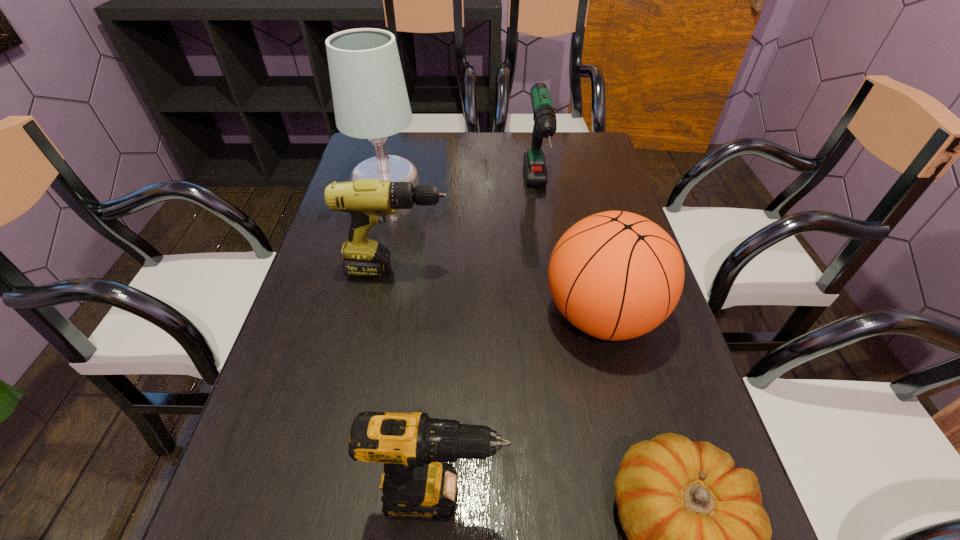
Locate an element on the screen. The width and height of the screenshot is (960, 540). vacant point located between the tallest object and the basketball is located at coordinates (494, 251).

Locate an element on the screen. free spot between the basketball and the tallest object is located at coordinates (494, 251).

What are the coordinates of `vacant space that's between the nearest drill and the basketball` in the screenshot? It's located at (521, 406).

This screenshot has height=540, width=960. I want to click on vacant space in between the tallest object and the nearest drill, so click(414, 341).

Find the location of a particular element. free area in between the second farthest drill and the nearest drill is located at coordinates (420, 383).

Identify which object is located as the second nearest to the nearest drill. Please provide its 2D coordinates. Your answer should be formatted as a tuple, i.e. [(x, y)], where the tuple contains the x and y coordinates of a point satisfying the conditions above.

[(615, 275)]

This screenshot has height=540, width=960. In order to click on the closest object to the gourd in this screenshot , I will do `click(415, 486)`.

Identify which drill is the closest to the basketball. Please provide its 2D coordinates. Your answer should be formatted as a tuple, i.e. [(x, y)], where the tuple contains the x and y coordinates of a point satisfying the conditions above.

[(545, 124)]

Select which drill is the second closest to the nearest drill. Please provide its 2D coordinates. Your answer should be formatted as a tuple, i.e. [(x, y)], where the tuple contains the x and y coordinates of a point satisfying the conditions above.

[(545, 124)]

Image resolution: width=960 pixels, height=540 pixels. Find the location of `vacant space that satisfies the following two spatial constraints: 1. on the back side of the basketball; 2. on the handle side of the second farthest drill`. vacant space that satisfies the following two spatial constraints: 1. on the back side of the basketball; 2. on the handle side of the second farthest drill is located at coordinates (590, 270).